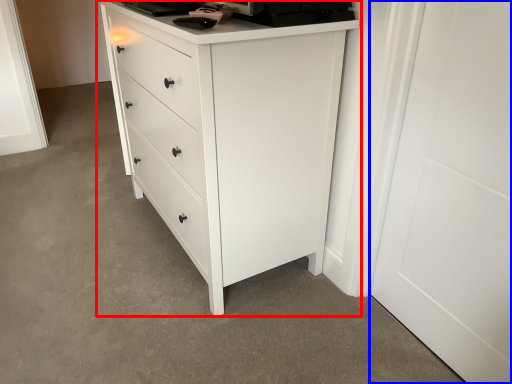
Question: Among these objects, which one is nearest to the camera, chest of drawers (highlighted by a red box) or door (highlighted by a blue box)?

Choices:
 (A) chest of drawers
 (B) door

Answer: (B)